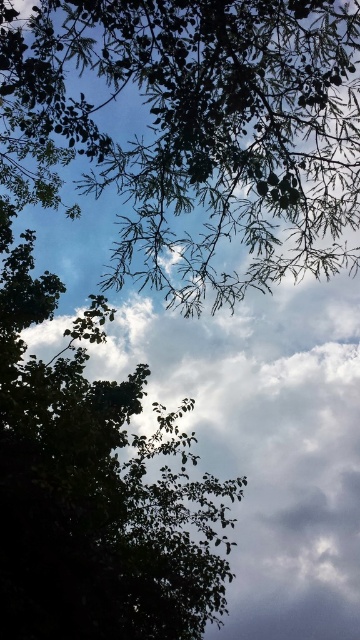
Question: Can you confirm if green leafy branches at upper center is thinner than green leafy tree at center?

Choices:
 (A) yes
 (B) no

Answer: (B)

Question: Considering the relative positions of green leafy branches at upper center and green leafy tree at center in the image provided, where is green leafy branches at upper center located with respect to green leafy tree at center?

Choices:
 (A) left
 (B) right

Answer: (B)

Question: Can you confirm if green leafy branches at upper center is wider than green leafy tree at center?

Choices:
 (A) no
 (B) yes

Answer: (B)

Question: Which of the following is the farthest from the observer?

Choices:
 (A) green leafy branches at upper center
 (B) green leafy tree at center

Answer: (A)